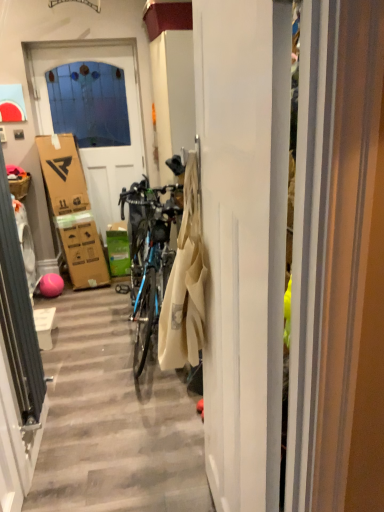
Question: Is green cardboard box at center far from white matte door at upper left, the 1th door in the back-to-front sequence?

Choices:
 (A) no
 (B) yes

Answer: (A)

Question: Does green cardboard box at center have a larger size compared to white matte door at upper left, which ranks as the 2th door in front-to-back order?

Choices:
 (A) yes
 (B) no

Answer: (B)

Question: Is green cardboard box at center positioned with its back to white matte door at upper left, which ranks as the 2th door in front-to-back order?

Choices:
 (A) yes
 (B) no

Answer: (A)

Question: Is green cardboard box at center surrounding white matte door at upper left, which is counted as the 2th door, starting from the right?

Choices:
 (A) no
 (B) yes

Answer: (A)

Question: Is green cardboard box at center wider than white matte door at upper left, the 1th door in the back-to-front sequence?

Choices:
 (A) yes
 (B) no

Answer: (A)

Question: Is white glossy washing machine at left inside or outside of white matte door at center, which ranks as the 1th door in front-to-back order?

Choices:
 (A) outside
 (B) inside

Answer: (A)

Question: Visually, is white glossy washing machine at left positioned to the left or to the right of white matte door at center, marked as the 1th door in a right-to-left arrangement?

Choices:
 (A) left
 (B) right

Answer: (A)

Question: From a real-world perspective, is white glossy washing machine at left positioned above or below white matte door at center, acting as the second door starting from the back?

Choices:
 (A) above
 (B) below

Answer: (B)

Question: Is white glossy washing machine at left bigger or smaller than white matte door at center, acting as the second door starting from the back?

Choices:
 (A) big
 (B) small

Answer: (B)

Question: Looking at the image, does white matte door at upper left, which is counted as the 2th door, starting from the right, seem bigger or smaller compared to brown cardboard picnic basket at left?

Choices:
 (A) small
 (B) big

Answer: (B)

Question: Is point (100, 159) closer or farther from the camera than point (18, 178)?

Choices:
 (A) farther
 (B) closer

Answer: (A)

Question: Is white matte door at upper left, which ranks as the 2th door in front-to-back order, inside or outside of brown cardboard picnic basket at left?

Choices:
 (A) outside
 (B) inside

Answer: (A)

Question: From the image's perspective, relative to brown cardboard picnic basket at left, is white matte door at upper left, which is counted as the 2th door, starting from the right, above or below?

Choices:
 (A) above
 (B) below

Answer: (A)

Question: Considering the positions of brown cardboard picnic basket at left and white glossy washing machine at left in the image, is brown cardboard picnic basket at left wider or thinner than white glossy washing machine at left?

Choices:
 (A) thin
 (B) wide

Answer: (B)

Question: Looking at the image, does brown cardboard picnic basket at left seem bigger or smaller compared to white glossy washing machine at left?

Choices:
 (A) small
 (B) big

Answer: (A)